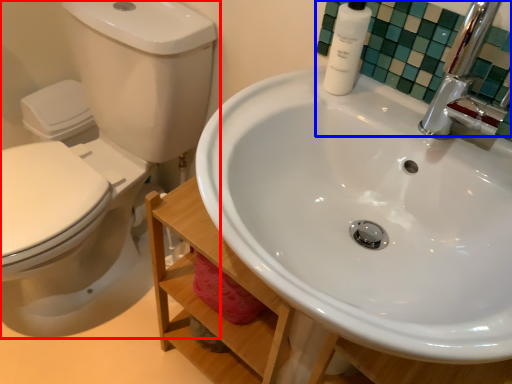
Question: Which of the following is the closest to the observer, toilet (highlighted by a red box) or mirror (highlighted by a blue box)?

Choices:
 (A) toilet
 (B) mirror

Answer: (A)